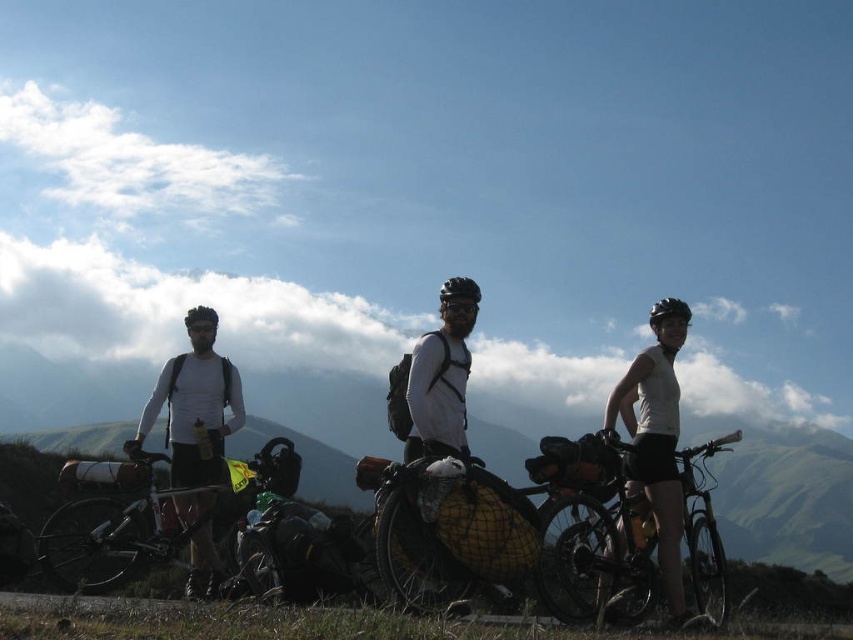
Which is in front, point (466, 376) or point (701, 472)?

Point (701, 472) is in front.

Can you confirm if white matte bicycle at center is positioned below matte black bicycle at center?

Incorrect, white matte bicycle at center is not positioned below matte black bicycle at center.

Who is more distant from viewer, (646, 456) or (570, 582)?

Positioned behind is point (646, 456).

The height and width of the screenshot is (640, 853). In order to click on white matte bicycle at center in this screenshot , I will do `click(653, 460)`.

Who is positioned more to the right, silver metallic bicycle at center or black matte bicycle helmet at upper right?

black matte bicycle helmet at upper right

Who is more distant from viewer, (x=106, y=486) or (x=679, y=298)?

The point (x=679, y=298) is more distant.

Where is `silver metallic bicycle at center`? silver metallic bicycle at center is located at coordinates (148, 515).

Does matte black bicycle at center have a lesser width compared to black matte bicycle helmet at center?

No, matte black bicycle at center is not thinner than black matte bicycle helmet at center.

Does point (625, 620) come farther from viewer compared to point (474, 301)?

No, it is in front of (474, 301).

At what (x,y) coordinates should I click in order to perform the action: click on matte black bicycle at center. Please return your answer as a coordinate pair (x, y). The width and height of the screenshot is (853, 640). Looking at the image, I should click on (590, 536).